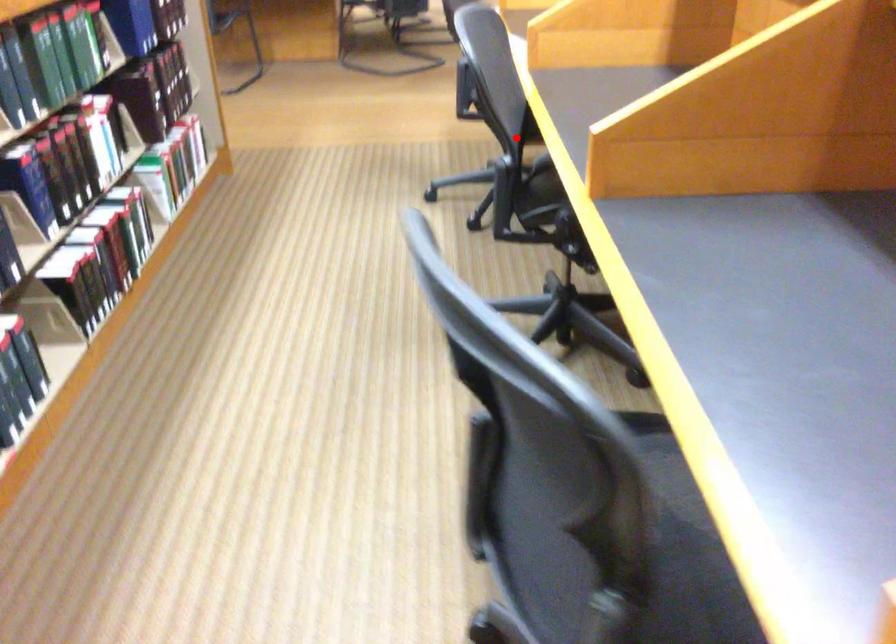
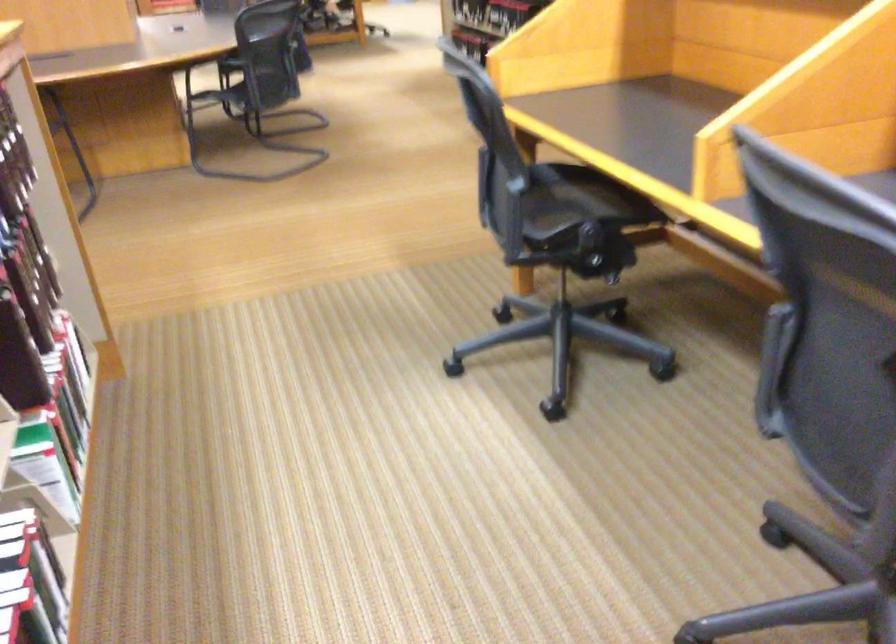
Locate, in the second image, the point that corresponds to the highlighted location in the first image.

(830, 341)